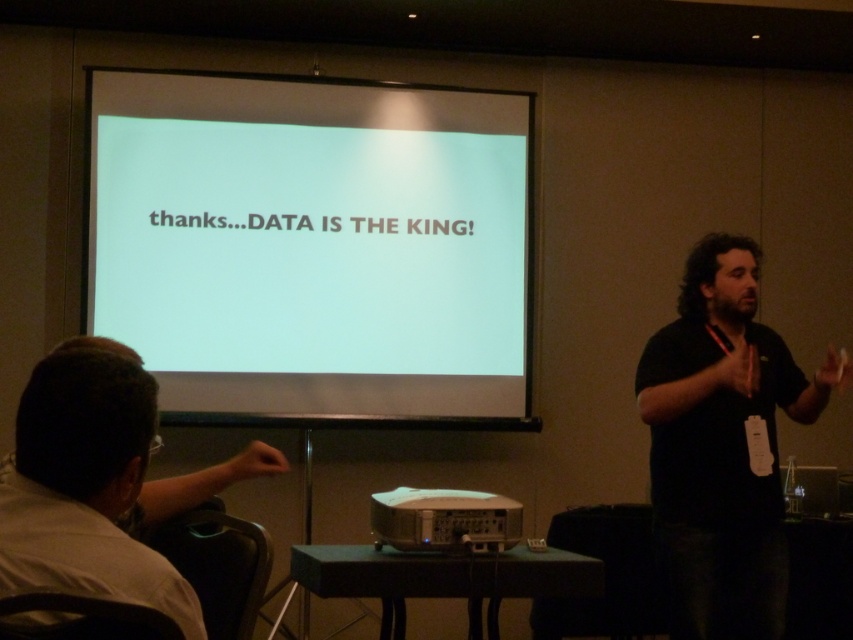
Does white matte projection screen at upper center have a greater width compared to black shirt at center?

Indeed, white matte projection screen at upper center has a greater width compared to black shirt at center.

The height and width of the screenshot is (640, 853). Describe the element at coordinates (314, 246) in the screenshot. I see `white matte projection screen at upper center` at that location.

Is point (265, 93) less distant than point (813, 388)?

No, (265, 93) is behind (813, 388).

Find the location of a particular element. The height and width of the screenshot is (640, 853). white matte projection screen at upper center is located at coordinates (314, 246).

Does black shirt at center have a lesser height compared to metallic projector at center?

In fact, black shirt at center may be taller than metallic projector at center.

Is black shirt at center smaller than metallic projector at center?

Incorrect, black shirt at center is not smaller in size than metallic projector at center.

Between point (782, 547) and point (393, 492), which one is positioned in front?

Positioned in front is point (782, 547).

In order to click on black shirt at center in this screenshot , I will do `click(722, 445)`.

Does white matte projection screen at upper center have a greater height compared to metallic projector at center?

Yes, white matte projection screen at upper center is taller than metallic projector at center.

In the scene shown: Does white matte projection screen at upper center appear over metallic projector at center?

Yes.

Between point (389, 250) and point (496, 524), which one is positioned behind?

Positioned behind is point (389, 250).

Find the location of `white matte projection screen at upper center`. white matte projection screen at upper center is located at coordinates (314, 246).